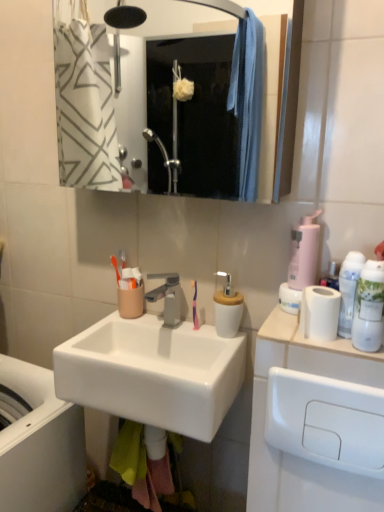
The image size is (384, 512). I want to click on vacant area to the right of satin nickel faucet at center, so click(x=204, y=336).